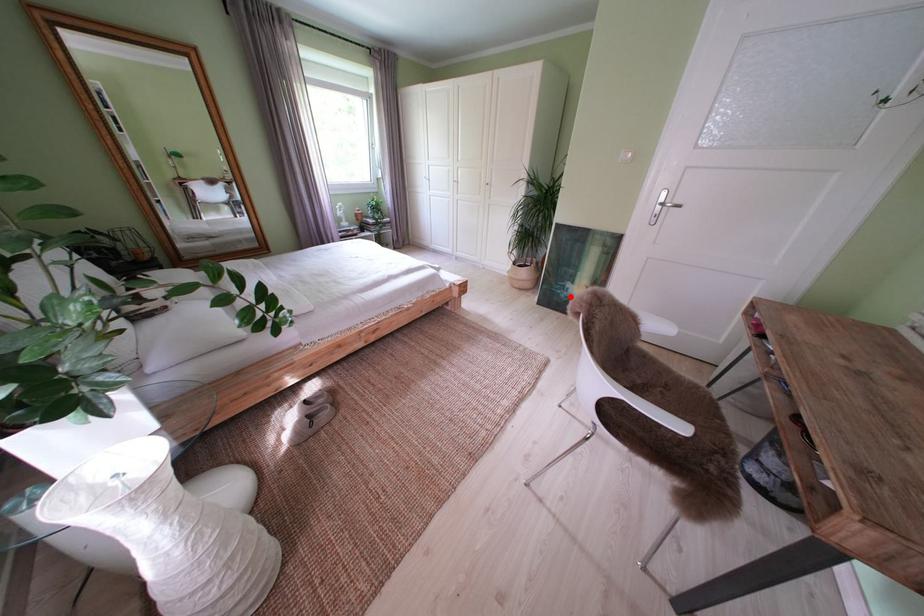
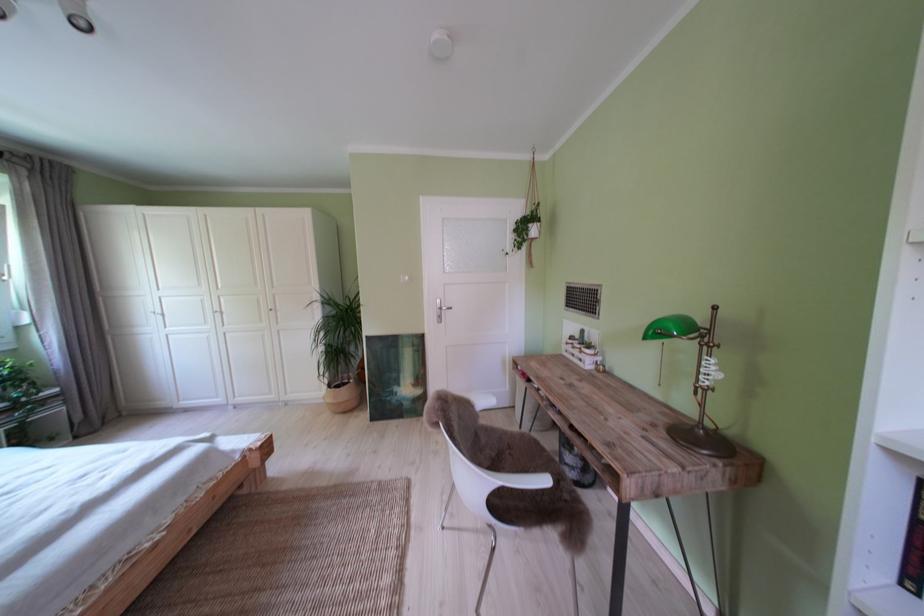
Question: I am providing you with two images of the same scene from different viewpoints. In image1, a red point is highlighted. Considering the same 3D point in image2, which of the following is correct?

Choices:
 (A) It is closer
 (B) It is farther

Answer: (B)